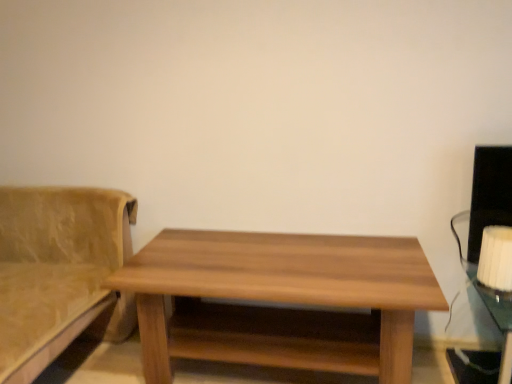
Question: Does point (486, 241) appear closer or farther from the camera than point (34, 319)?

Choices:
 (A) farther
 (B) closer

Answer: (A)

Question: From the image's perspective, is white fabric lampshade at right above or below suede-like beige couch at left?

Choices:
 (A) above
 (B) below

Answer: (A)

Question: Based on their relative distances, which object is farther from the white fabric lampshade at right?

Choices:
 (A) suede-like beige couch at left
 (B) wooden table at center

Answer: (A)

Question: Which of these objects is positioned farthest from the white fabric lampshade at right?

Choices:
 (A) wooden table at center
 (B) suede-like beige couch at left

Answer: (B)